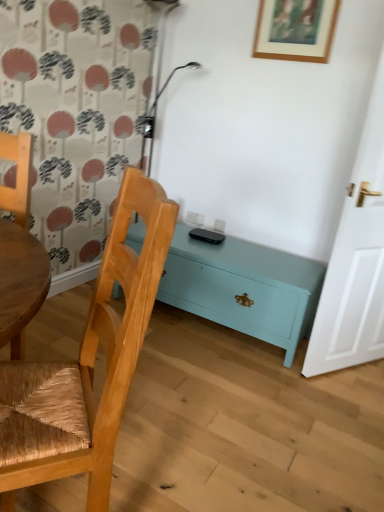
Question: Relative to woven wood chair at left, the second chair from the left, is teal painted wood chest at lower center in front or behind?

Choices:
 (A) behind
 (B) front

Answer: (A)

Question: Considering the positions of teal painted wood chest at lower center and woven wood chair at left, which ranks as the first chair in right-to-left order, in the image, is teal painted wood chest at lower center taller or shorter than woven wood chair at left, which ranks as the first chair in right-to-left order,?

Choices:
 (A) short
 (B) tall

Answer: (A)

Question: Estimate the real-world distances between objects in this image. Which object is farther from the white wooden door at right?

Choices:
 (A) woven wood chair at left, which ranks as the first chair in right-to-left order
 (B) wooden woven chair at left, which ranks as the first chair in left-to-right order
 (C) wooden picture frame at upper center
 (D) teal painted wood chest at lower center

Answer: (B)

Question: Estimate the real-world distances between objects in this image. Which object is farther from the wooden woven chair at left, which ranks as the first chair in left-to-right order?

Choices:
 (A) wooden picture frame at upper center
 (B) white wooden door at right
 (C) teal painted wood chest at lower center
 (D) woven wood chair at left, which ranks as the first chair in right-to-left order

Answer: (A)